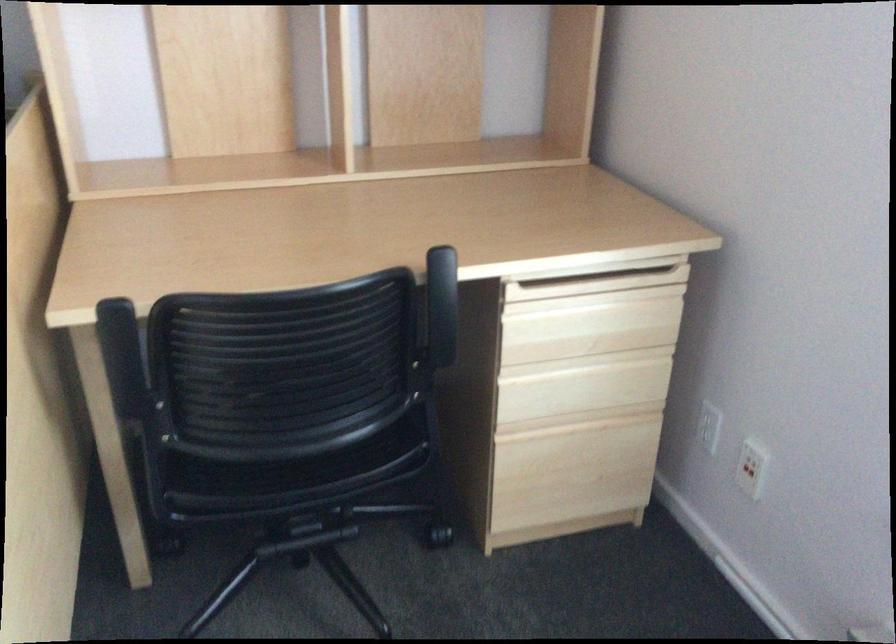
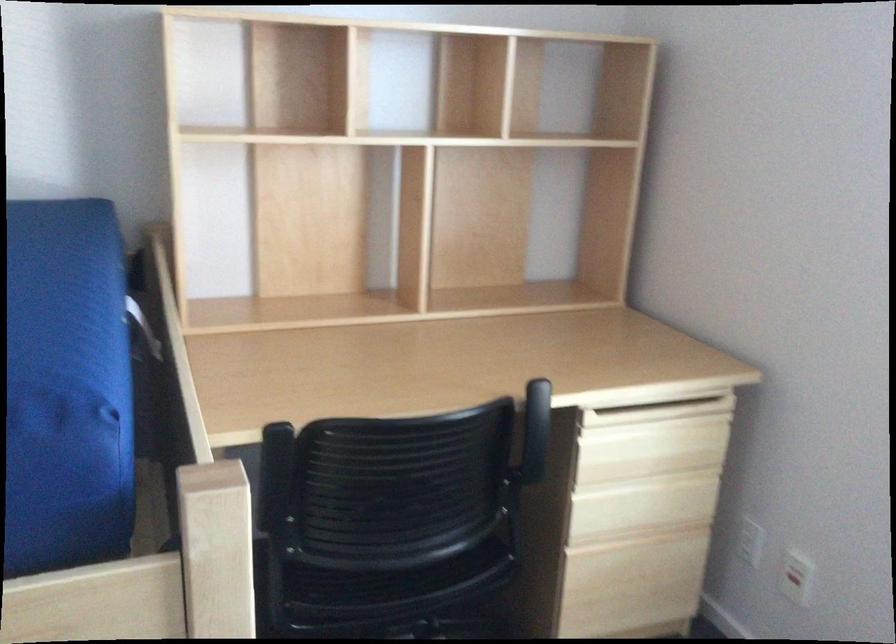
In the second image, find the point that corresponds to point (124, 355) in the first image.

(273, 474)